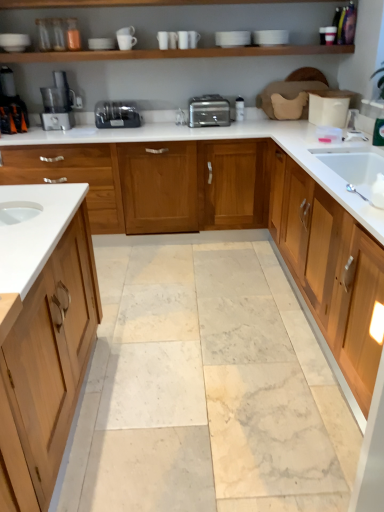
Describe the element at coordinates (224, 139) in the screenshot. I see `white glossy countertop at center` at that location.

This screenshot has height=512, width=384. What do you see at coordinates (329, 268) in the screenshot? I see `wooden cabinet at right` at bounding box center [329, 268].

The height and width of the screenshot is (512, 384). What are the coordinates of `wooden cabinet at right` in the screenshot? It's located at (329, 268).

From the picture: Measure the distance between point (x=64, y=103) and camera.

Point (x=64, y=103) and camera are 3.53 meters apart from each other.

I want to click on silver metallic toaster at center, so click(208, 111).

Measure the distance between point (x=14, y=117) and camera.

A distance of 11.03 feet exists between point (x=14, y=117) and camera.

Locate an element on the screen. The image size is (384, 512). white glossy countertop at center is located at coordinates pos(224,139).

Is black plastic coffee machine at left in front of wooden cabinet at right?

No, black plastic coffee machine at left is further to the viewer.

From the image's perspective, is black plastic coffee machine at left on top of wooden cabinet at right?

Yes.

Considering the sizes of objects black plastic coffee machine at left and wooden cabinet at right in the image provided, who is taller, black plastic coffee machine at left or wooden cabinet at right?

Standing taller between the two is wooden cabinet at right.

Between point (10, 116) and point (342, 311), which one is positioned behind?

The point (10, 116) is more distant.

Between marble tile floor at center and silver metallic faucet at center, which one appears on the right side from the viewer's perspective?

Positioned to the right is marble tile floor at center.

Identify the location of faucet on the left of the marble tile floor at center. (180, 117).

Choose the correct answer: Is marble tile floor at center inside silver metallic faucet at center or outside it?

marble tile floor at center is not inside silver metallic faucet at center, it's outside.

Could you tell me if marble tile floor at center is turned towards silver metallic faucet at center?

No, marble tile floor at center is not aimed at silver metallic faucet at center.

Which of these two, silver metallic toaster at center or satin silver food processor at left, is wider?

Wider between the two is silver metallic toaster at center.

From the picture: Choose the correct answer: Is silver metallic toaster at center inside satin silver food processor at left or outside it?

silver metallic toaster at center lies outside satin silver food processor at left.

Is silver metallic toaster at center oriented towards satin silver food processor at left?

No, silver metallic toaster at center is not turned towards satin silver food processor at left.

Would you consider satin silver toaster at center to be distant from silver metallic toaster at center?

No, satin silver toaster at center is in close proximity to silver metallic toaster at center.

Does satin silver toaster at center have a larger size compared to silver metallic toaster at center?

Actually, satin silver toaster at center might be smaller than silver metallic toaster at center.

From a real-world perspective, is satin silver toaster at center physically above silver metallic toaster at center?

No, from a real-world perspective, satin silver toaster at center is not above silver metallic toaster at center.

Is satin silver toaster at center shorter than silver metallic toaster at center?

Yes, satin silver toaster at center is shorter than silver metallic toaster at center.

From the image's perspective, is white glossy countertop at center below wooden cabinet at right?

No.

Does white glossy countertop at center turn towards wooden cabinet at right?

Yes.

Based on the photo, measure the distance from white glossy countertop at center to wooden cabinet at right.

white glossy countertop at center is 46.09 centimeters from wooden cabinet at right.

Can you confirm if white glossy countertop at center is thinner than wooden cabinet at right?

Correct, the width of white glossy countertop at center is less than that of wooden cabinet at right.

Visually, is satin silver toaster at center positioned to the left or to the right of black plastic coffee machine at left?

From the image, it's evident that satin silver toaster at center is to the right of black plastic coffee machine at left.

Does satin silver toaster at center turn towards black plastic coffee machine at left?

No, satin silver toaster at center is not turned towards black plastic coffee machine at left.

Between satin silver toaster at center and black plastic coffee machine at left, which one is positioned behind?

satin silver toaster at center.

Can you confirm if satin silver toaster at center is smaller than black plastic coffee machine at left?

Yes, satin silver toaster at center is smaller than black plastic coffee machine at left.

Consider the image. Considering the relative sizes of marble tile floor at center and satin silver toaster at center in the image provided, is marble tile floor at center smaller than satin silver toaster at center?

Actually, marble tile floor at center might be larger than satin silver toaster at center.

Consider the image. From the image's perspective, does marble tile floor at center appear lower than satin silver toaster at center?

Yes, from the image's perspective, marble tile floor at center is below satin silver toaster at center.

This screenshot has width=384, height=512. I want to click on granite below the satin silver toaster at center (from the image's perspective), so click(x=206, y=386).

Is satin silver toaster at center a part of marble tile floor at center?

No, marble tile floor at center does not contain satin silver toaster at center.

Where is `cabinetry in front of the black plastic coffee machine at left`? Image resolution: width=384 pixels, height=512 pixels. cabinetry in front of the black plastic coffee machine at left is located at coordinates (329, 268).

At what (x,y) coordinates should I click in order to perform the action: click on faucet above the marble tile floor at center (from a real-world perspective). Please return your answer as a coordinate pair (x, y). The height and width of the screenshot is (512, 384). Looking at the image, I should click on (180, 117).

When comparing their distances from satin silver toaster at center, does marble tile floor at center or wooden cabinet at right seem further?

The object further to satin silver toaster at center is marble tile floor at center.

Considering their positions, is black plastic coffee machine at left positioned closer to satin silver food processor at left than silver metallic faucet at center?

The object closer to satin silver food processor at left is black plastic coffee machine at left.

Based on their spatial positions, is satin silver food processor at left or silver metallic faucet at center closer to satin silver toaster at center?

satin silver food processor at left.

From the image, which object appears to be nearer to white glossy countertop at center, satin silver food processor at left or black plastic coffee machine at left?

satin silver food processor at left.

From the image, which object appears to be farther from satin silver food processor at left, silver metallic toaster at center or white glossy countertop at center?

silver metallic toaster at center is positioned further to the anchor satin silver food processor at left.

Looking at the image, which one is located closer to silver metallic faucet at center, black plastic coffee machine at left or silver metallic toaster at center?

silver metallic toaster at center is positioned closer to the anchor silver metallic faucet at center.

Looking at the image, which one is located further to wooden cabinet at right, black plastic coffee machine at left or silver metallic faucet at center?

black plastic coffee machine at left lies further to wooden cabinet at right than the other object.

Based on their spatial positions, is silver metallic faucet at center or satin silver food processor at left closer to wooden cabinet at right?

silver metallic faucet at center is closer to wooden cabinet at right.

Locate an element on the screen. countertop between black plastic coffee machine at left and silver metallic faucet at center from left to right is located at coordinates (224, 139).

At what (x,y) coordinates should I click in order to perform the action: click on coffee machine between marble tile floor at center and silver metallic toaster at center in the front-back direction. Please return your answer as a coordinate pair (x, y). This screenshot has width=384, height=512. Looking at the image, I should click on (11, 105).

What are the coordinates of `countertop located between wooden cabinet at right and satin silver toaster at center in the depth direction` in the screenshot? It's located at coord(224,139).

Locate an element on the screen. countertop between satin silver food processor at left and silver metallic toaster at center in the horizontal direction is located at coordinates (224, 139).